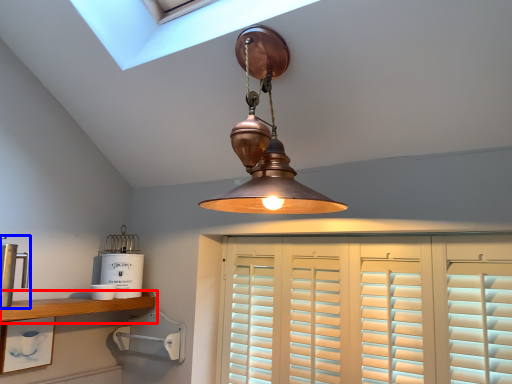
Question: Which object appears closest to the camera in this image, shelf (highlighted by a red box) or appliance (highlighted by a blue box)?

Choices:
 (A) shelf
 (B) appliance

Answer: (B)